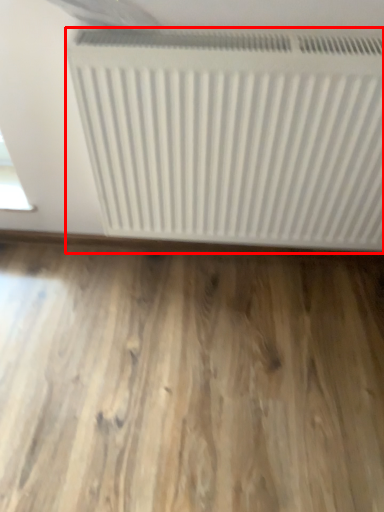
Question: Observing the image, what is the correct spatial positioning of radiator (annotated by the red box) in reference to hardwood?

Choices:
 (A) left
 (B) right

Answer: (B)